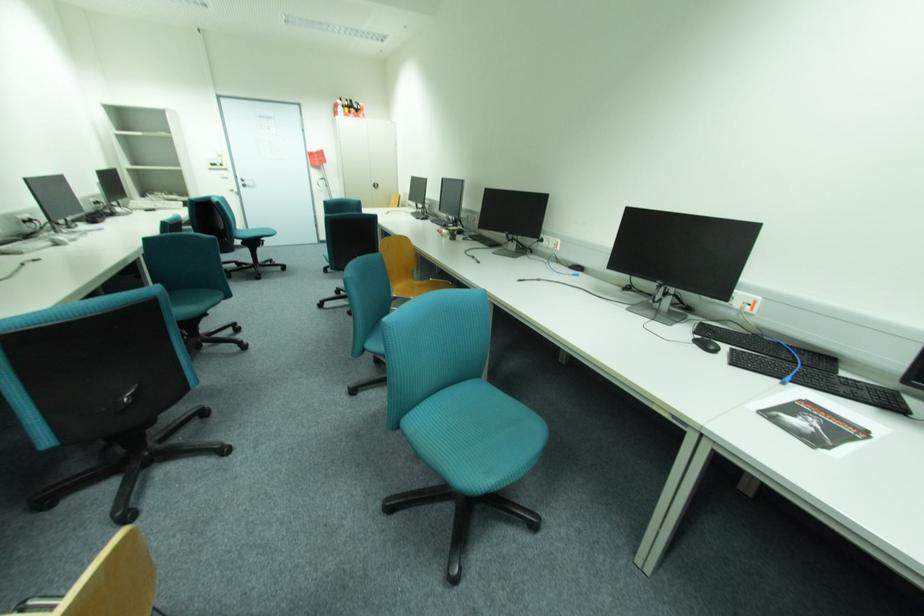
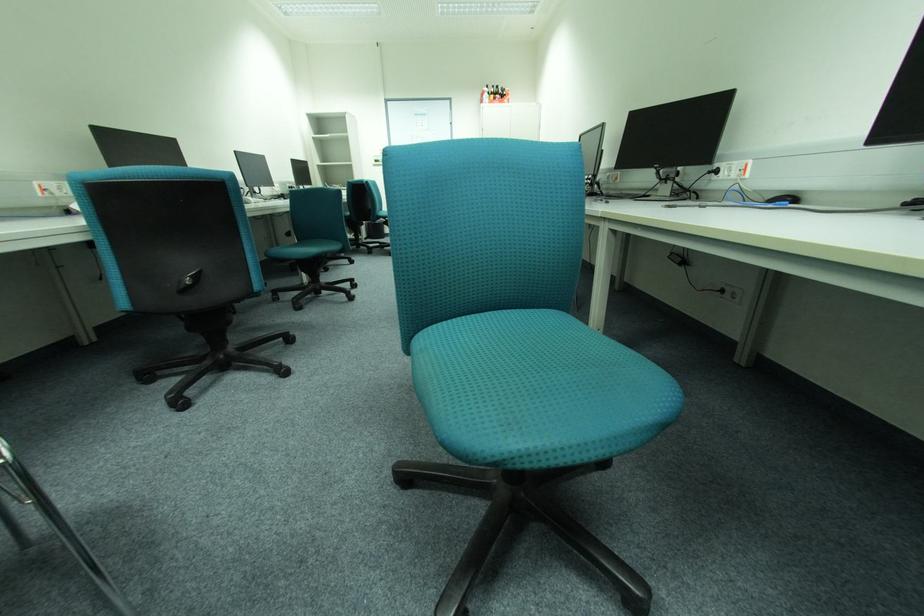
The images are taken continuously from a first-person perspective. In which direction are you moving?

The movement direction of the cameraman is right, forward.